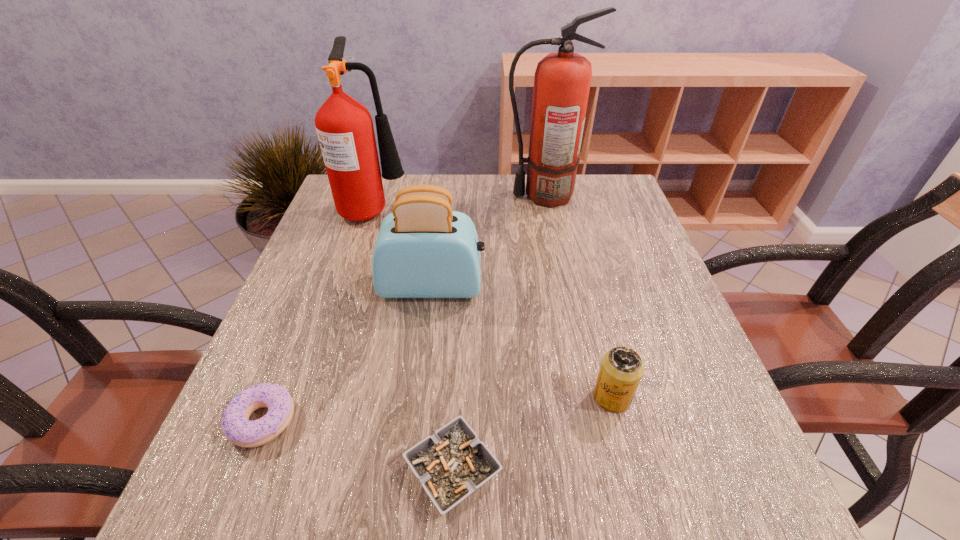
You are a GUI agent. You are given a task and a screenshot of the screen. Output one action in this format:
    pyautogui.click(x=<x>, y=<y>)
    Task: Click on the vacant space in between the ashtray and the second tallest object
    The height and width of the screenshot is (540, 960).
    Given the screenshot: What is the action you would take?
    pyautogui.click(x=414, y=340)

Find the location of a particular element. The width and height of the screenshot is (960, 540). vacant space in between the right fire extinguisher and the shortest object is located at coordinates (498, 333).

Identify the location of unoccupied area between the shorter fire extinguisher and the second shortest object. (319, 315).

Locate an element on the screen. The height and width of the screenshot is (540, 960). vacant area between the fourth nearest object and the right fire extinguisher is located at coordinates (488, 241).

At what (x,y) coordinates should I click in order to perform the action: click on vacant area between the doughnut and the left fire extinguisher. Please return your answer as a coordinate pair (x, y). This screenshot has width=960, height=540. Looking at the image, I should click on (319, 315).

You are a GUI agent. You are given a task and a screenshot of the screen. Output one action in this format:
    pyautogui.click(x=<x>, y=<y>)
    Task: Click on the free space between the ashtray and the toaster
    The height and width of the screenshot is (540, 960).
    Given the screenshot: What is the action you would take?
    pyautogui.click(x=443, y=379)

Identify the location of object that is the closest to the doughnut. The width and height of the screenshot is (960, 540). (x=453, y=463).

This screenshot has height=540, width=960. I want to click on object identified as the third closest to the fourth tallest object, so click(235, 423).

Find the location of a particular element. The image size is (960, 540). blank area in the image that satisfies the following two spatial constraints: 1. at the nozzle of the shorter fire extinguisher; 2. on the left side of the ashtray is located at coordinates (292, 471).

I want to click on free space that satisfies the following two spatial constraints: 1. at the nozzle of the ashtray; 2. on the right side of the fifth shortest object, so click(292, 471).